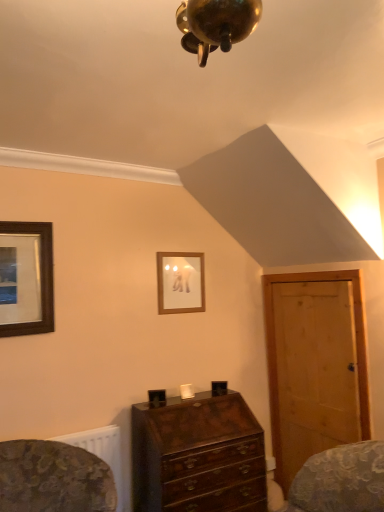
Question: Is light brown wooden door at right taller or shorter than wooden framed picture at left, marked as the first picture frame in a left-to-right arrangement?

Choices:
 (A) tall
 (B) short

Answer: (A)

Question: In terms of width, does light brown wooden door at right look wider or thinner when compared to wooden framed picture at left, marked as the first picture frame in a left-to-right arrangement?

Choices:
 (A) wide
 (B) thin

Answer: (B)

Question: Estimate the real-world distances between objects in this image. Which object is farther from the wooden picture frame at upper center, the second picture frame viewed from the left?

Choices:
 (A) wooden framed picture at left, the 1th picture frame from the front
 (B) light brown wooden door at right
 (C) mahogany wooden chest of drawers at center

Answer: (A)

Question: Estimate the real-world distances between objects in this image. Which object is farther from the wooden framed picture at left, which appears as the 2th picture frame when viewed from the back?

Choices:
 (A) mahogany wooden chest of drawers at center
 (B) wooden picture frame at upper center, the second picture frame viewed from the left
 (C) light brown wooden door at right

Answer: (C)